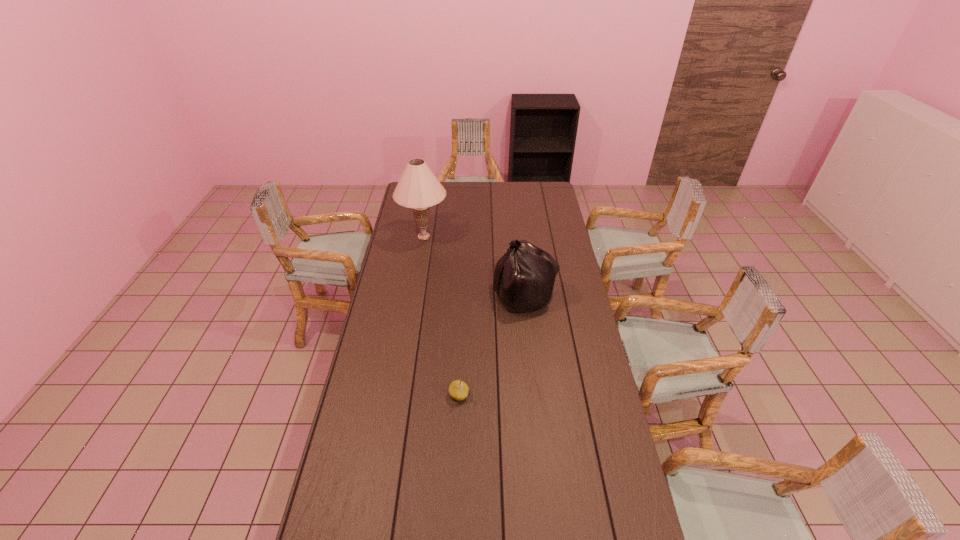
I want to click on object that is the closest one to the second nearest object, so click(418, 188).

Where is `free point that satisfies the following two spatial constraints: 1. on the front side of the pear; 2. on the right side of the tallest object`? The height and width of the screenshot is (540, 960). free point that satisfies the following two spatial constraints: 1. on the front side of the pear; 2. on the right side of the tallest object is located at coordinates (397, 395).